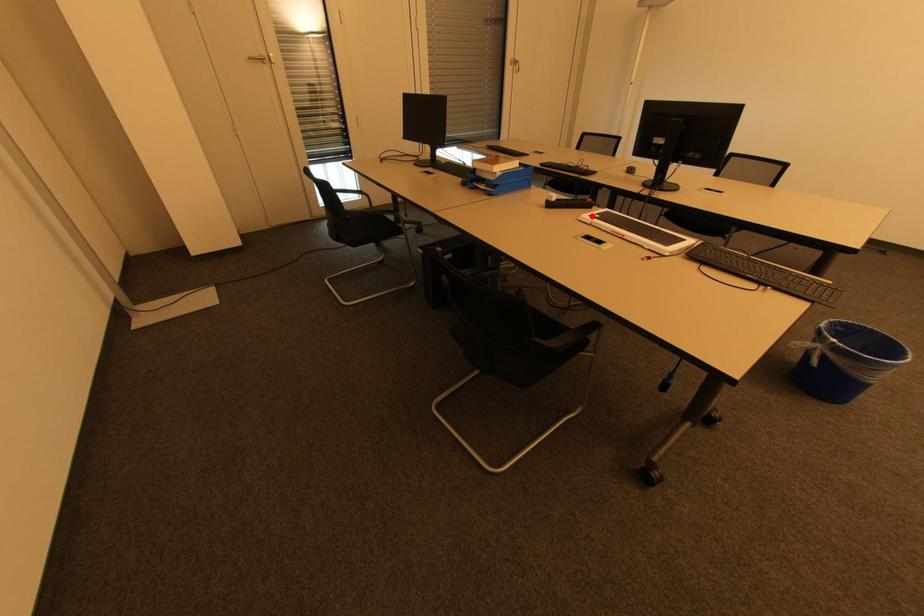
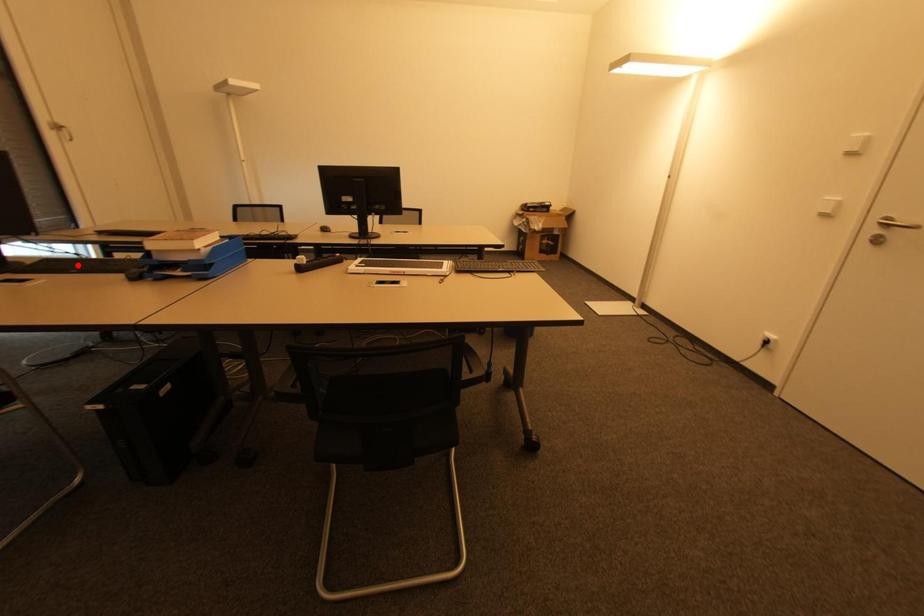
I am providing you with two images of the same scene from different viewpoints. A red point is marked on the first image and another point is marked on the second image. Does the point marked in image1 correspond to the same location as the one in image2?

No